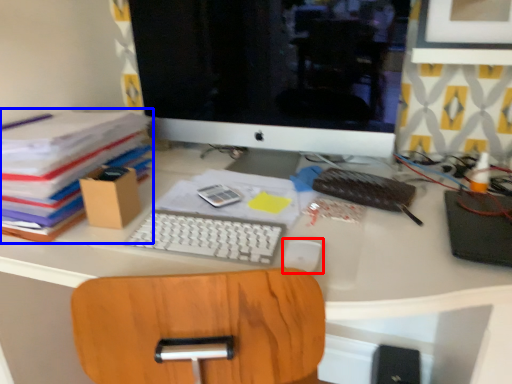
Question: Which point is further to the camera, mouse (highlighted by a red box) or paperback book (highlighted by a blue box)?

Choices:
 (A) mouse
 (B) paperback book

Answer: (B)